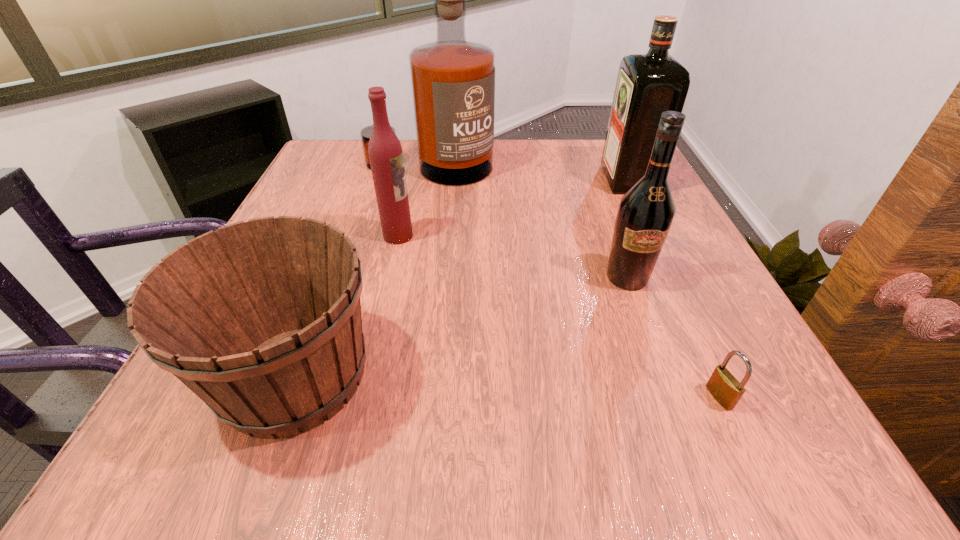
At what (x,y) coordinates should I click in order to perform the action: click on the second closest object to the shortest liquor. Please return your answer as a coordinate pair (x, y). The height and width of the screenshot is (540, 960). Looking at the image, I should click on (261, 319).

Identify which object is the fourth closest to the tallest liquor. Please provide its 2D coordinates. Your answer should be formatted as a tuple, i.e. [(x, y)], where the tuple contains the x and y coordinates of a point satisfying the conditions above.

[(261, 319)]

Identify which liquor is the second nearest to the shortest object. Please provide its 2D coordinates. Your answer should be formatted as a tuple, i.e. [(x, y)], where the tuple contains the x and y coordinates of a point satisfying the conditions above.

[(385, 152)]

The image size is (960, 540). Identify the location of liquor that is the second closest to the nearest liquor. (647, 85).

I want to click on free space that satisfies the following two spatial constraints: 1. on the front side of the wine bucket; 2. on the right side of the padlock, so point(286,397).